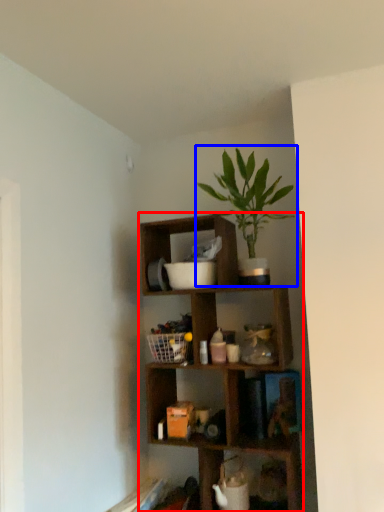
Question: Which point is closer to the camera, shelf (highlighted by a red box) or houseplant (highlighted by a blue box)?

Choices:
 (A) shelf
 (B) houseplant

Answer: (B)